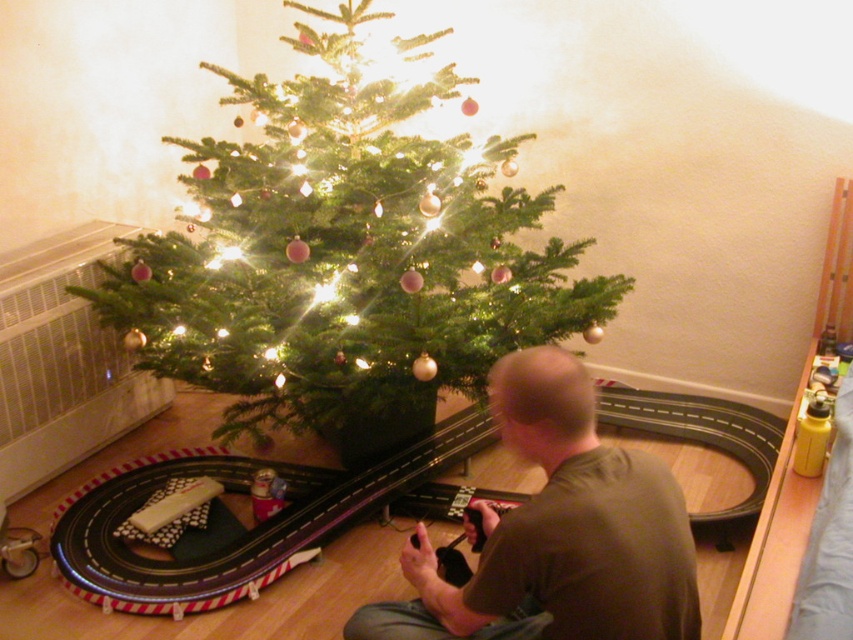
Is green matte christmas tree at center wider than brown cotton shirt at center?

Yes, green matte christmas tree at center is wider than brown cotton shirt at center.

Which of these two, green matte christmas tree at center or brown cotton shirt at center, stands taller?

green matte christmas tree at center

Is point (241, 358) behind point (606, 625)?

Yes, point (241, 358) is farther from viewer.

You are a GUI agent. You are given a task and a screenshot of the screen. Output one action in this format:
    pyautogui.click(x=<x>, y=<y>)
    Task: Click on the green matte christmas tree at center
    
    Given the screenshot: What is the action you would take?
    pyautogui.click(x=345, y=257)